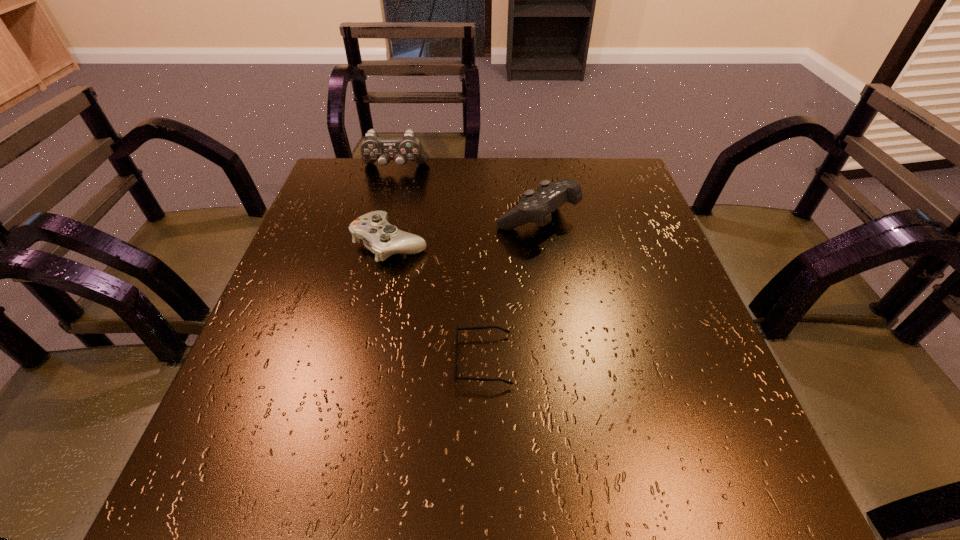
This screenshot has width=960, height=540. What are the coordinates of `free space between the second shortest object and the tallest control` in the screenshot? It's located at (393, 206).

Locate an element on the screen. This screenshot has width=960, height=540. object that is the closest one to the tallest control is located at coordinates (378, 235).

Point out which object is positioned as the nearest to the second tallest object. Please provide its 2D coordinates. Your answer should be formatted as a tuple, i.e. [(x, y)], where the tuple contains the x and y coordinates of a point satisfying the conditions above.

[(378, 235)]

The height and width of the screenshot is (540, 960). What are the coordinates of `the closest control to the sunglasses` in the screenshot? It's located at (378, 235).

The image size is (960, 540). Identify the location of control that stands as the second closest to the farthest control. (537, 207).

Identify the location of free space in the image that satisfies the following two spatial constraints: 1. on the surface of the farthest object with buttons; 2. on the left side of the shortest control. The height and width of the screenshot is (540, 960). (376, 243).

This screenshot has width=960, height=540. Identify the location of vacant space that satisfies the following two spatial constraints: 1. on the surface of the tallest object with buttons; 2. on the right side of the second shortest object. click(376, 243).

You are a GUI agent. You are given a task and a screenshot of the screen. Output one action in this format:
    pyautogui.click(x=<x>, y=<y>)
    Task: Click on the free space that satisfies the following two spatial constraints: 1. on the back side of the third shortest object; 2. on the right side of the third tallest object
    This screenshot has height=540, width=960.
    Given the screenshot: What is the action you would take?
    pyautogui.click(x=396, y=219)

In order to click on vacant region that satisfies the following two spatial constraints: 1. on the surface of the tallest control with buttons; 2. on the right side of the rightmost control in this screenshot , I will do `click(383, 219)`.